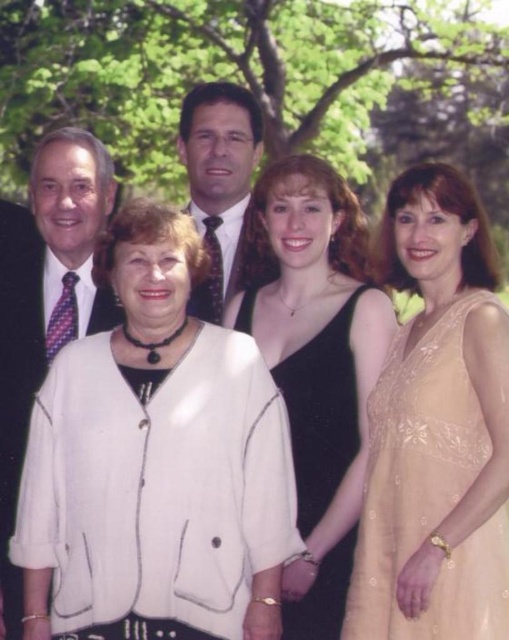
Based on the photo, can you confirm if white fabric jacket at center is smaller than black satin dress at center?

Incorrect, white fabric jacket at center is not smaller in size than black satin dress at center.

Which is above, white fabric jacket at center or black satin dress at center?

white fabric jacket at center

The width and height of the screenshot is (509, 640). What do you see at coordinates (155, 464) in the screenshot? I see `white fabric jacket at center` at bounding box center [155, 464].

Image resolution: width=509 pixels, height=640 pixels. I want to click on white fabric jacket at center, so click(155, 464).

Who is taller, black satin dress at center or matte black suit at center?

Standing taller between the two is black satin dress at center.

Is the position of black satin dress at center less distant than that of matte black suit at center?

That is True.

You are a GUI agent. You are given a task and a screenshot of the screen. Output one action in this format:
    pyautogui.click(x=<x>, y=<y>)
    Task: Click on the black satin dress at center
    
    Given the screenshot: What is the action you would take?
    pyautogui.click(x=322, y=412)

Locate an element on the screen. Image resolution: width=509 pixels, height=640 pixels. black satin dress at center is located at coordinates (322, 412).

Is white fabric jacket at center above matte black suit at center?

No.

At what (x,y) coordinates should I click in order to perform the action: click on white fabric jacket at center. Please return your answer as a coordinate pair (x, y). This screenshot has width=509, height=640. Looking at the image, I should click on (155, 464).

Identify the location of white fabric jacket at center. This screenshot has width=509, height=640. (155, 464).